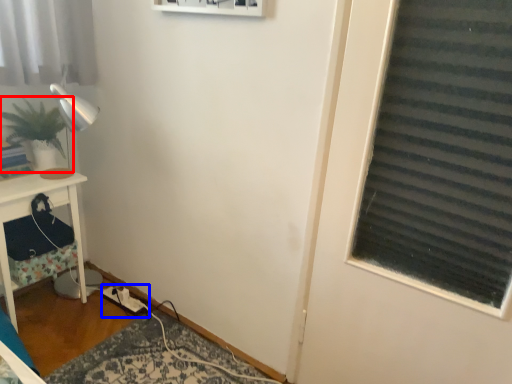
Question: Which object appears farthest to the camera in this image, houseplant (highlighted by a red box) or extension cord (highlighted by a blue box)?

Choices:
 (A) houseplant
 (B) extension cord

Answer: (B)